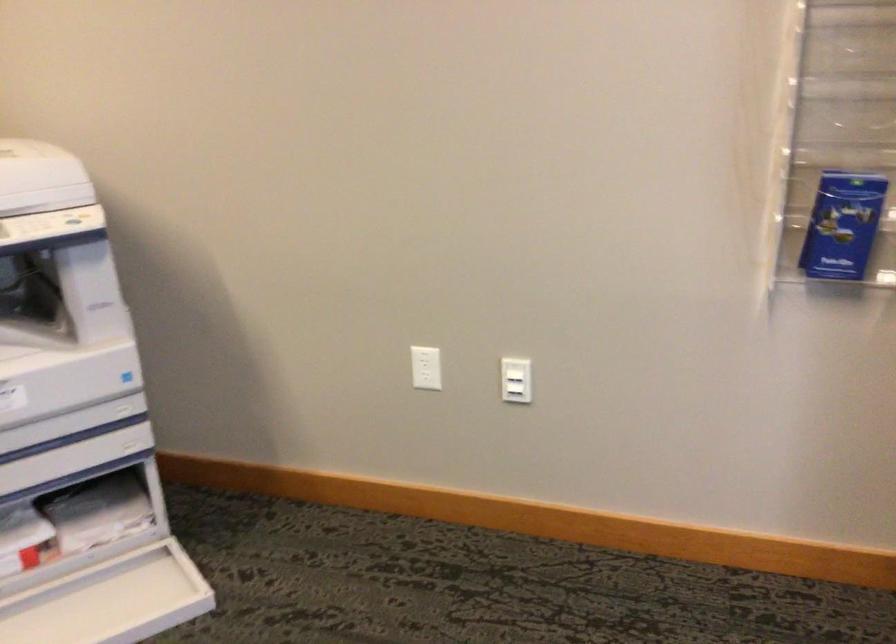
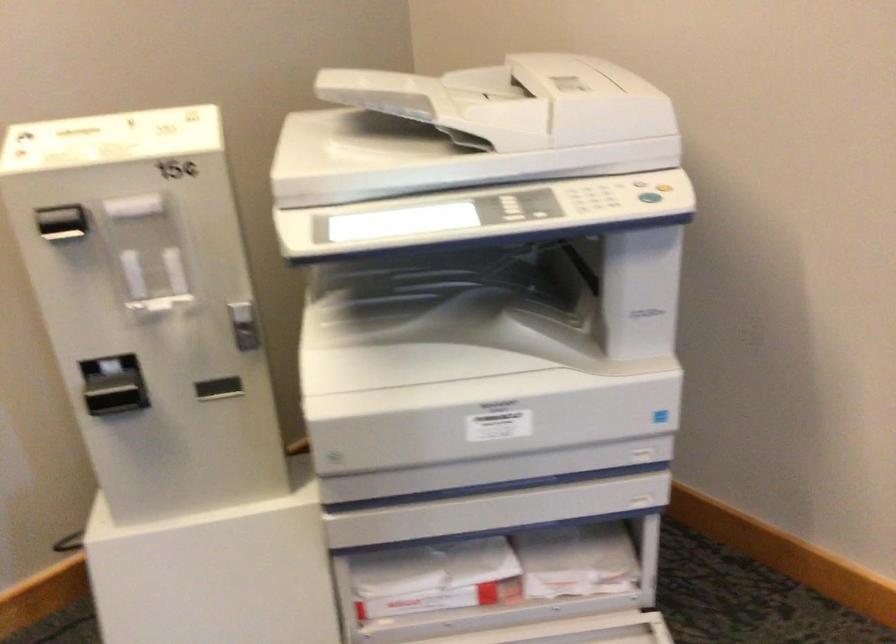
Locate, in the second image, the point that corresponds to pixel 106 516 in the first image.

(576, 561)